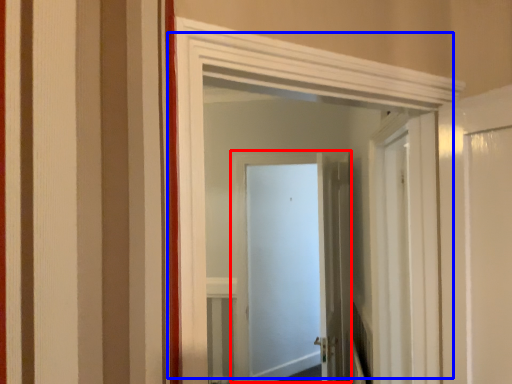
Question: Which object appears closest to the camera in this image, door (highlighted by a red box) or door (highlighted by a blue box)?

Choices:
 (A) door
 (B) door

Answer: (B)